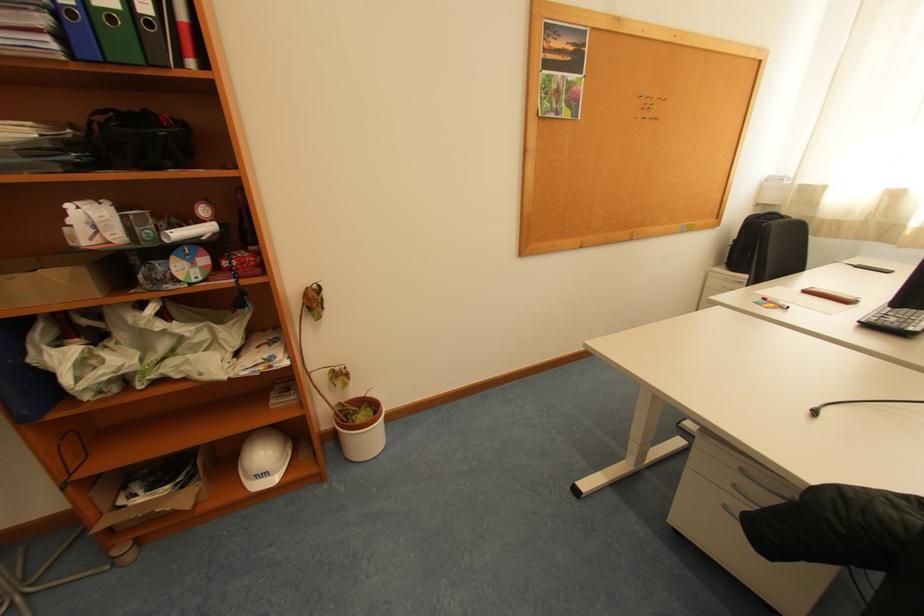
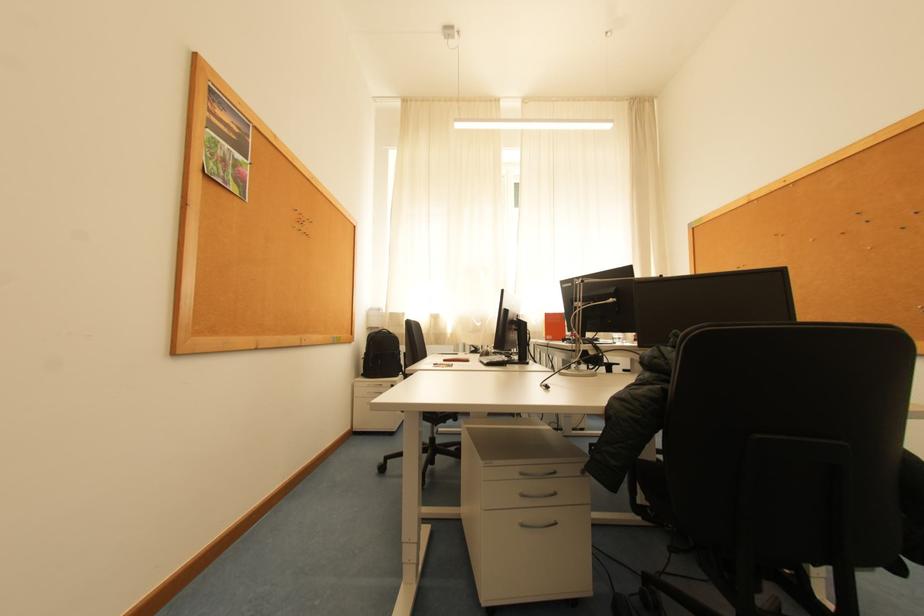
In the second image, find the point that corresponds to the point at 743,238 in the first image.

(372, 353)